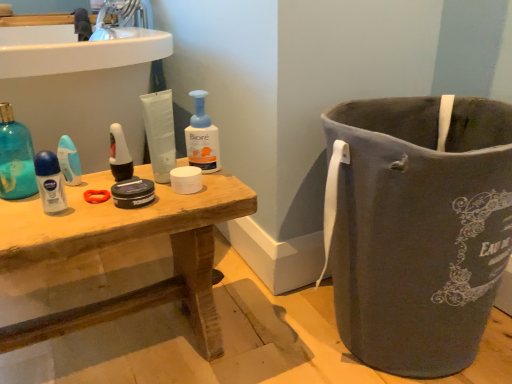
The width and height of the screenshot is (512, 384). In order to click on free space between matte white shaving cream at left and white matte toothbrush at center in this screenshot , I will do `click(93, 187)`.